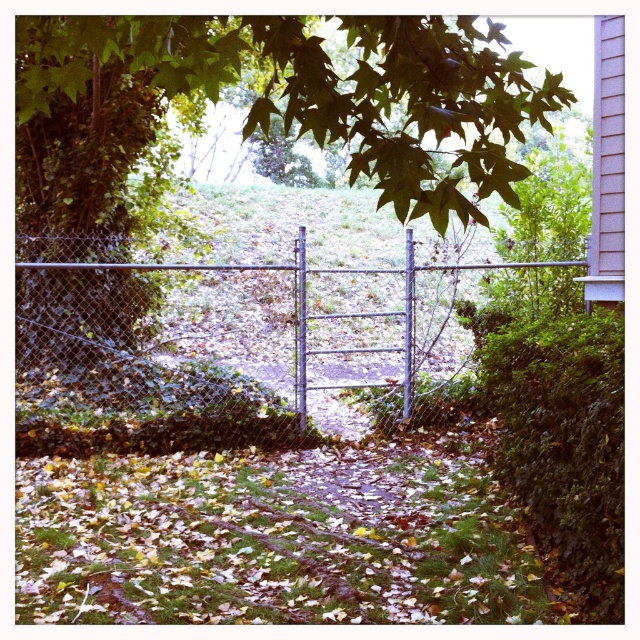
Question: Does green leafy tree at center lie behind metallic chain-link fence at center?

Choices:
 (A) no
 (B) yes

Answer: (A)

Question: Is green leafy hedge at right behind metallic chain-link fence at center?

Choices:
 (A) no
 (B) yes

Answer: (A)

Question: Which point is farther to the camera?

Choices:
 (A) green leafy tree at center
 (B) metallic chain-link fence at center

Answer: (B)

Question: Is green leafy tree at center behind metallic chain-link fence at center?

Choices:
 (A) yes
 (B) no

Answer: (B)

Question: Which is farther from the green leafy tree at center?

Choices:
 (A) green leafy hedge at right
 (B) metallic chain-link fence at center

Answer: (B)

Question: Which of the following is the closest to the observer?

Choices:
 (A) metallic chain-link fence at center
 (B) green leafy hedge at right
 (C) green leafy tree at center

Answer: (C)